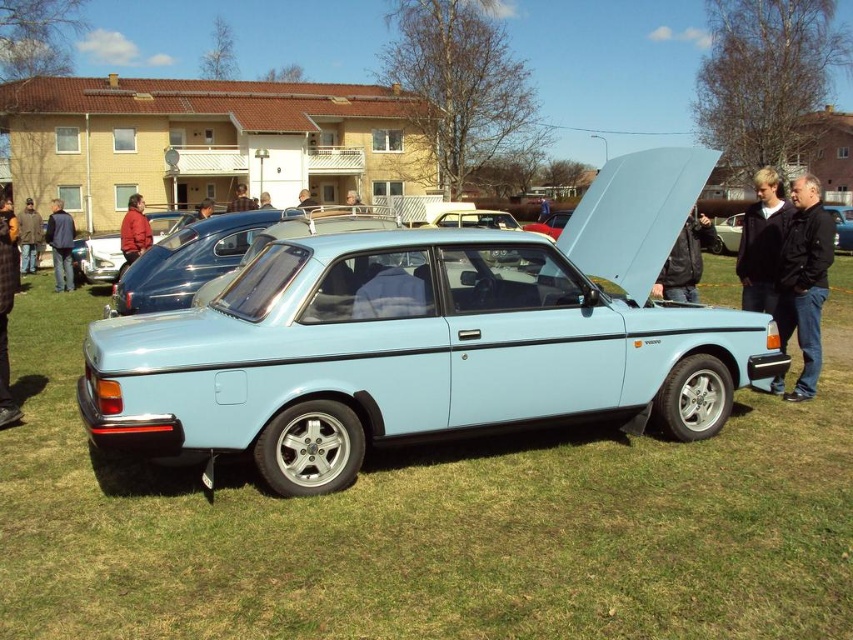
You are at a car show and see two jackets displayed near the classic Volvo car. The jackets are the denim jacket at left and the blue fabric jacket at center. Which jacket is positioned more to the left?

The denim jacket at left is positioned more to the left than the blue fabric jacket at center.

You are standing in front of the light blue Volvo car and want to take a photo of both the point at coordinates point (28, 266) and point (206, 209). Which point should you focus on first to ensure both are in focus?

You should focus on point (28, 266) first because it is closer to the camera than point (206, 209). This ensures the closer point is in focus, and the farther point will also be sharp due to depth of field.

You are at a car show and see two jackets displayed on mannequins near the light blue Volvo car. The jackets are the denim jacket at left and the blue fabric jacket at center. Which jacket is shorter in height?

The denim jacket at left is not as tall as the blue fabric jacket at center, so the denim jacket at left is shorter in height.